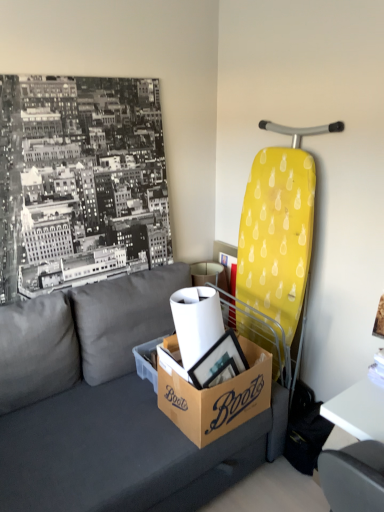
Measure the distance between point (381, 484) and camera.

Point (381, 484) is 29.13 inches from camera.

Measure the distance between point (153, 334) and camera.

They are 2.17 meters apart.

Where is `brown cardboard box at lower center`? brown cardboard box at lower center is located at coordinates (147, 361).

Who is shorter, white glossy table at lower right or dark gray fabric couch at center?

Standing shorter between the two is white glossy table at lower right.

How much distance is there between white glossy table at lower right and dark gray fabric couch at center?

white glossy table at lower right is 90.13 centimeters from dark gray fabric couch at center.

Are white glossy table at lower right and dark gray fabric couch at center located far from each other?

No, white glossy table at lower right is in close proximity to dark gray fabric couch at center.

You are a GUI agent. You are given a task and a screenshot of the screen. Output one action in this format:
    pyautogui.click(x=<x>, y=<y>)
    Task: Click on the box above the dark gray fabric couch at center (from the image's perspective)
    This screenshot has width=384, height=512.
    Given the screenshot: What is the action you would take?
    pyautogui.click(x=215, y=396)

From a real-world perspective, does dark gray fabric couch at center sit lower than brown cardboard box at center?

Indeed, from a real-world perspective, dark gray fabric couch at center is positioned beneath brown cardboard box at center.

Considering the relative sizes of dark gray fabric couch at center and brown cardboard box at center in the image provided, is dark gray fabric couch at center shorter than brown cardboard box at center?

No.

Is point (110, 483) closer or farther from the camera than point (207, 441)?

Clearly, point (110, 483) is closer to the camera than point (207, 441).

Which object is further away from the camera, white glossy table at lower right or brown cardboard box at center?

white glossy table at lower right is behind.

Can you confirm if white glossy table at lower right is taller than brown cardboard box at center?

Correct, white glossy table at lower right is much taller as brown cardboard box at center.

Could you tell me if white glossy table at lower right is facing brown cardboard box at center?

No, white glossy table at lower right is not oriented towards brown cardboard box at center.

From a real-world perspective, is white glossy table at lower right below brown cardboard box at center?

Indeed, from a real-world perspective, white glossy table at lower right is positioned beneath brown cardboard box at center.

From a real-world perspective, is brown cardboard box at center over white glossy table at lower right?

Yes, from a real-world perspective, brown cardboard box at center is above white glossy table at lower right.

From the image's perspective, relative to white glossy table at lower right, is brown cardboard box at center above or below?

brown cardboard box at center is above white glossy table at lower right.

Is brown cardboard box at center bigger or smaller than white glossy table at lower right?

In the image, brown cardboard box at center appears to be larger than white glossy table at lower right.

Does brown cardboard box at center have a greater height compared to white glossy table at lower right?

Incorrect, the height of brown cardboard box at center is not larger of that of white glossy table at lower right.

From a real-world perspective, is brown cardboard box at lower center beneath brown cardboard box at center?

Indeed, from a real-world perspective, brown cardboard box at lower center is positioned beneath brown cardboard box at center.

Can we say brown cardboard box at lower center lies outside brown cardboard box at center?

Yes, brown cardboard box at lower center is not within brown cardboard box at center.

How different are the orientations of brown cardboard box at lower center and brown cardboard box at center in degrees?

There is a 92.2-degree angle between the facing directions of brown cardboard box at lower center and brown cardboard box at center.

Is brown cardboard box at lower center next to brown cardboard box at center?

brown cardboard box at lower center is not next to brown cardboard box at center, and they're not touching.

Who is bigger, white glossy table at lower right or brown cardboard box at lower center?

white glossy table at lower right.

Between white glossy table at lower right and brown cardboard box at lower center, which one has more height?

Standing taller between the two is white glossy table at lower right.

Are white glossy table at lower right and brown cardboard box at lower center making contact?

No.

Is brown cardboard box at lower center inside white glossy table at lower right?

Actually, brown cardboard box at lower center is outside white glossy table at lower right.

From the image's perspective, which object appears higher, dark gray fabric couch at center or white glossy table at lower right?

From the image's view, dark gray fabric couch at center is above.

I want to click on studio couch in front of the white glossy table at lower right, so click(107, 407).

From a real-world perspective, which object rests below the other?

white glossy table at lower right.

Between dark gray fabric couch at center and white glossy table at lower right, which one has larger width?

dark gray fabric couch at center is wider.

You are a GUI agent. You are given a task and a screenshot of the screen. Output one action in this format:
    pyautogui.click(x=<x>, y=<y>)
    Task: Click on the studio couch in front of the white glossy table at lower right
    
    Given the screenshot: What is the action you would take?
    pyautogui.click(x=107, y=407)

This screenshot has width=384, height=512. In the image, there is a dark gray fabric couch at center. Identify the location of box above it (from the image's perspective). (215, 396).

Looking at the image, which one is located further to white glossy table at lower right, brown cardboard box at center or brown cardboard box at lower center?

Among the two, brown cardboard box at lower center is located further to white glossy table at lower right.

Estimate the real-world distances between objects in this image. Which object is further from brown cardboard box at lower center, dark gray fabric couch at center or brown cardboard box at center?

dark gray fabric couch at center.

From the image, which object appears to be farther from brown cardboard box at lower center, white glossy table at lower right or dark gray fabric couch at center?

Based on the image, white glossy table at lower right appears to be further to brown cardboard box at lower center.

From the image, which object appears to be farther from dark gray fabric couch at center, white glossy table at lower right or brown cardboard box at lower center?

white glossy table at lower right is positioned further to the anchor dark gray fabric couch at center.

In the scene shown: From the image, which object appears to be farther from white glossy table at lower right, dark gray fabric couch at center or brown cardboard box at lower center?

dark gray fabric couch at center lies further to white glossy table at lower right than the other object.

Considering their positions, is brown cardboard box at center positioned closer to white glossy table at lower right than dark gray fabric couch at center?

Result: Based on the image, brown cardboard box at center appears to be nearer to white glossy table at lower right.

When comparing their distances from white glossy table at lower right, does brown cardboard box at lower center or brown cardboard box at center seem closer?

brown cardboard box at center is closer to white glossy table at lower right.

From the picture: Based on their spatial positions, is brown cardboard box at center or dark gray fabric couch at center closer to brown cardboard box at lower center?

Based on the image, brown cardboard box at center appears to be nearer to brown cardboard box at lower center.

Identify the location of cardboard box located between dark gray fabric couch at center and white glossy table at lower right in the left-right direction. (147, 361).

The height and width of the screenshot is (512, 384). I want to click on box between brown cardboard box at lower center and white glossy table at lower right in the horizontal direction, so click(x=215, y=396).

Locate an element on the screen. The image size is (384, 512). box between dark gray fabric couch at center and white glossy table at lower right from left to right is located at coordinates (215, 396).

Identify the location of box between dark gray fabric couch at center and brown cardboard box at lower center in the front-back direction. (215, 396).